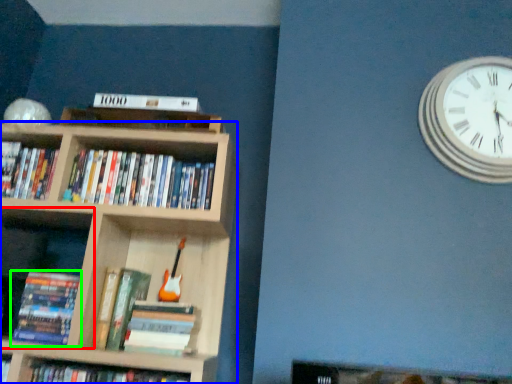
Question: Which object is the closest to the shelf (highlighted by a red box)? Choose among these: bookcase (highlighted by a blue box) or book (highlighted by a green box).

Choices:
 (A) bookcase
 (B) book

Answer: (B)